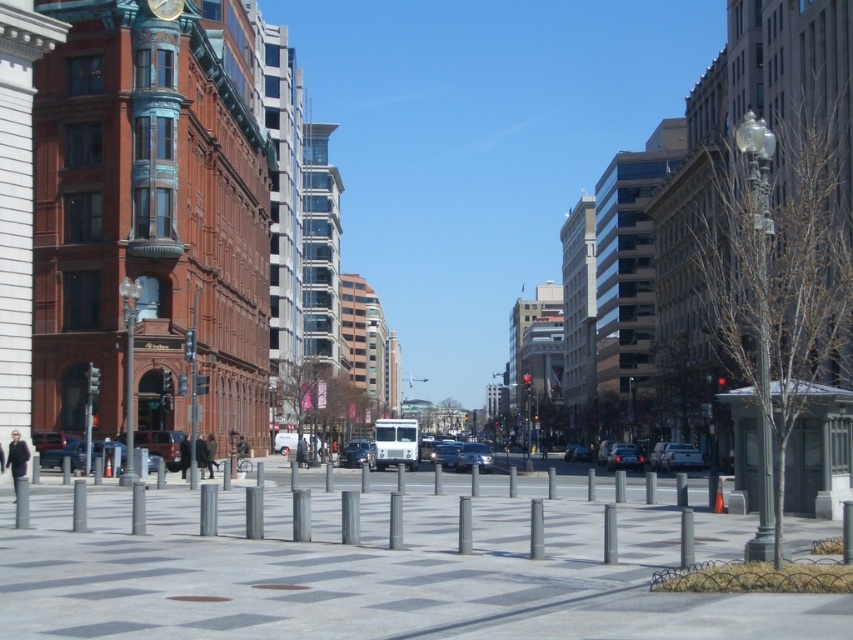
Question: Which of the following is the farthest from the observer?

Choices:
 (A) gray concrete pavement at center
 (B) matte black sedan at center
 (C) shiny silver sedan at center
 (D) metallic streetlight at left

Answer: (C)

Question: Can you confirm if shiny silver sedan at center is positioned above gold metallic clock at upper center?

Choices:
 (A) yes
 (B) no

Answer: (B)

Question: Is silver metallic sedan at center bigger than shiny blue sedan at center?

Choices:
 (A) yes
 (B) no

Answer: (B)

Question: Among these points, which one is nearest to the camera?

Choices:
 (A) (630, 454)
 (B) (189, 353)
 (C) (434, 538)

Answer: (C)

Question: Which of the following is the farthest from the observer?

Choices:
 (A) metallic streetlight at left
 (B) silver metallic sedan at center
 (C) gray concrete pavement at center
 (D) matte black sedan at center

Answer: (B)

Question: Does matte black sedan at center lie in front of gold metallic clock at upper center?

Choices:
 (A) yes
 (B) no

Answer: (A)